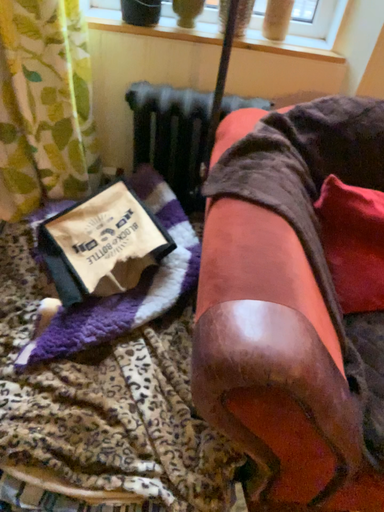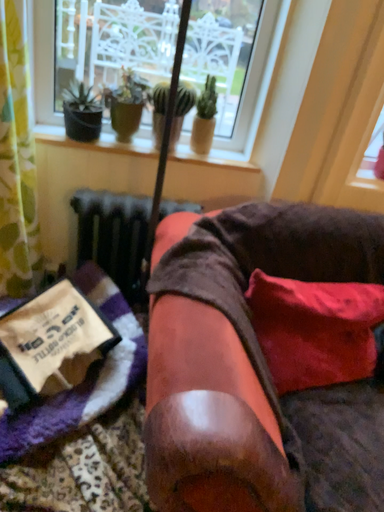
Question: How did the camera likely rotate when shooting the video?

Choices:
 (A) rotated downward
 (B) rotated upward

Answer: (B)